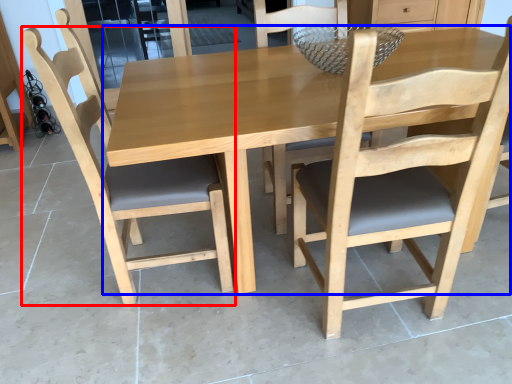
Question: Which point is further to the camera, chair (highlighted by a red box) or kitchen & dining room table (highlighted by a blue box)?

Choices:
 (A) chair
 (B) kitchen & dining room table

Answer: (A)